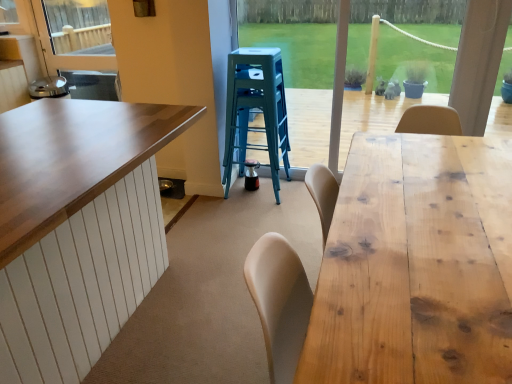
Question: From the image's perspective, is teal plastic stool at center above natural wood table at right?

Choices:
 (A) no
 (B) yes

Answer: (B)

Question: Can you confirm if teal plastic stool at center is bigger than natural wood table at right?

Choices:
 (A) yes
 (B) no

Answer: (B)

Question: Is the depth of teal plastic stool at center less than that of natural wood table at right?

Choices:
 (A) yes
 (B) no

Answer: (B)

Question: From a real-world perspective, is teal plastic stool at center beneath natural wood table at right?

Choices:
 (A) yes
 (B) no

Answer: (B)

Question: Considering the relative sizes of teal plastic stool at center and natural wood table at right in the image provided, is teal plastic stool at center wider than natural wood table at right?

Choices:
 (A) no
 (B) yes

Answer: (A)

Question: Considering the positions of point (347, 165) and point (243, 112), is point (347, 165) closer or farther from the camera than point (243, 112)?

Choices:
 (A) farther
 (B) closer

Answer: (B)

Question: From the image's perspective, is natural wood table at right positioned above or below teal plastic stool at center?

Choices:
 (A) below
 (B) above

Answer: (A)

Question: Is natural wood table at right in front of or behind teal plastic stool at center in the image?

Choices:
 (A) front
 (B) behind

Answer: (A)

Question: From a real-world perspective, is natural wood table at right positioned above or below teal plastic stool at center?

Choices:
 (A) below
 (B) above

Answer: (A)

Question: In terms of width, does wooden frame at center look wider or thinner when compared to natural wood table at right?

Choices:
 (A) wide
 (B) thin

Answer: (B)

Question: From a real-world perspective, relative to natural wood table at right, is wooden frame at center vertically above or below?

Choices:
 (A) below
 (B) above

Answer: (B)

Question: From the image's perspective, relative to natural wood table at right, is wooden frame at center above or below?

Choices:
 (A) above
 (B) below

Answer: (A)

Question: Looking at the image, does wooden frame at center seem bigger or smaller compared to natural wood table at right?

Choices:
 (A) big
 (B) small

Answer: (B)

Question: Is point (245, 135) closer or farther from the camera than point (349, 342)?

Choices:
 (A) farther
 (B) closer

Answer: (A)

Question: Considering the positions of teal plastic stool at center and natural wood table at right in the image, is teal plastic stool at center taller or shorter than natural wood table at right?

Choices:
 (A) tall
 (B) short

Answer: (A)